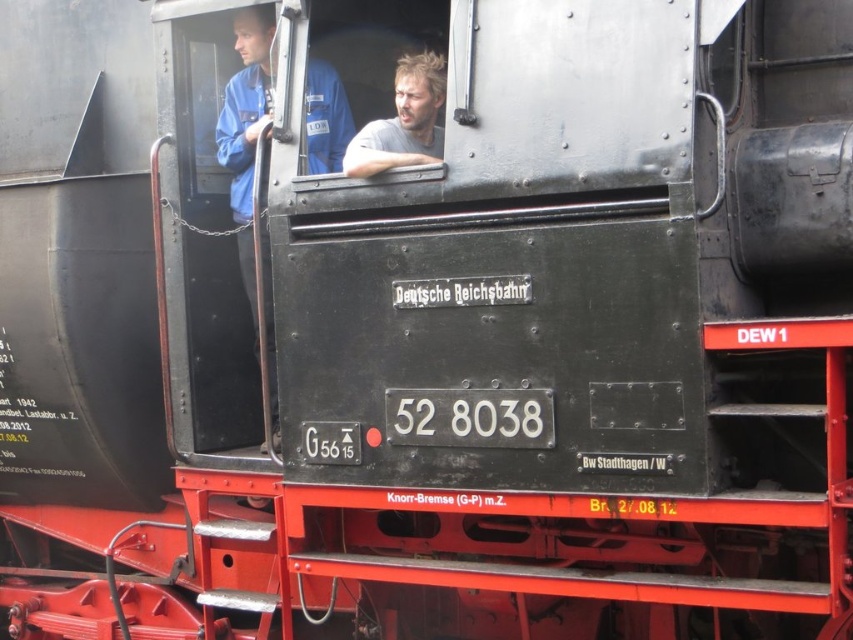
Question: Which point appears farthest from the camera in this image?

Choices:
 (A) (317, 99)
 (B) (421, 56)

Answer: (A)

Question: Does blue fabric shirt at left have a larger size compared to light brown hair at center?

Choices:
 (A) yes
 (B) no

Answer: (A)

Question: Can you confirm if blue fabric shirt at left is positioned below light brown hair at center?

Choices:
 (A) no
 (B) yes

Answer: (B)

Question: Which of the following is the farthest from the observer?

Choices:
 (A) blue fabric shirt at left
 (B) light brown hair at center

Answer: (A)

Question: Can you confirm if blue fabric shirt at left is smaller than light brown hair at center?

Choices:
 (A) no
 (B) yes

Answer: (A)

Question: Which of the following is the closest to the observer?

Choices:
 (A) (428, 54)
 (B) (317, 141)

Answer: (A)